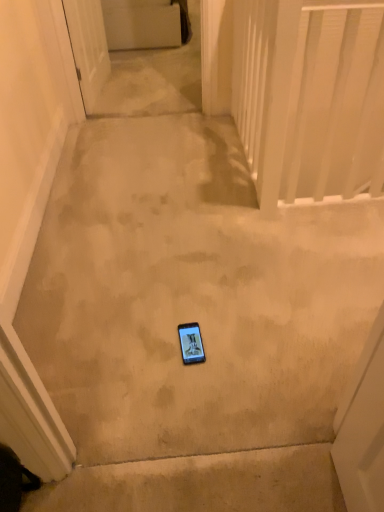
Question: Considering the relative positions of white plastic balustrade at upper right and matte black phone at center in the image provided, is white plastic balustrade at upper right to the left or to the right of matte black phone at center?

Choices:
 (A) right
 (B) left

Answer: (A)

Question: From the image's perspective, relative to matte black phone at center, is white plastic balustrade at upper right above or below?

Choices:
 (A) below
 (B) above

Answer: (B)

Question: Considering the real-world distances, which object is farthest from the matte black phone at center?

Choices:
 (A) white glossy door at upper left
 (B) white plastic balustrade at upper right

Answer: (A)

Question: Considering the real-world distances, which object is closest to the white glossy door at upper left?

Choices:
 (A) matte black phone at center
 (B) white plastic balustrade at upper right

Answer: (B)